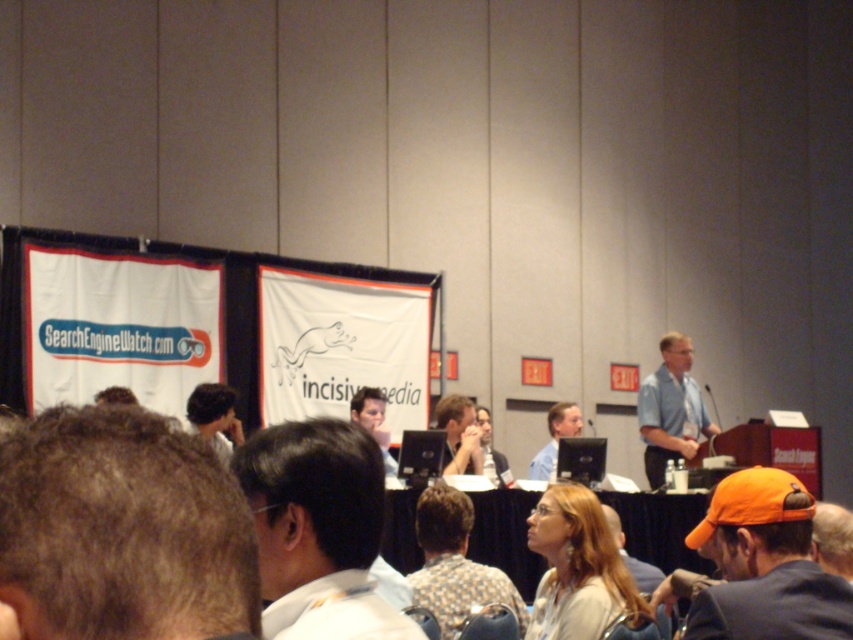
Question: Can you confirm if dark brown hair at center is thinner than matte black laptop at center?

Choices:
 (A) yes
 (B) no

Answer: (B)

Question: Can you confirm if brown hair at lower left is positioned above matte blue shirt at center?

Choices:
 (A) yes
 (B) no

Answer: (A)

Question: Which of these objects is positioned farthest from the orange baseball cap at lower right?

Choices:
 (A) brown hair at lower left
 (B) matte white blouse at center
 (C) white shirt at center

Answer: (A)

Question: Which point is closer to the camera?

Choices:
 (A) (583, 557)
 (B) (648, 563)
 (C) (656, 396)
 (D) (727, 516)

Answer: (D)

Question: Which point is closer to the camera?

Choices:
 (A) dark brown hair at center
 (B) brown hair at lower left

Answer: (B)

Question: Is matte blue shirt at center below matte black shirt at center?

Choices:
 (A) no
 (B) yes

Answer: (B)